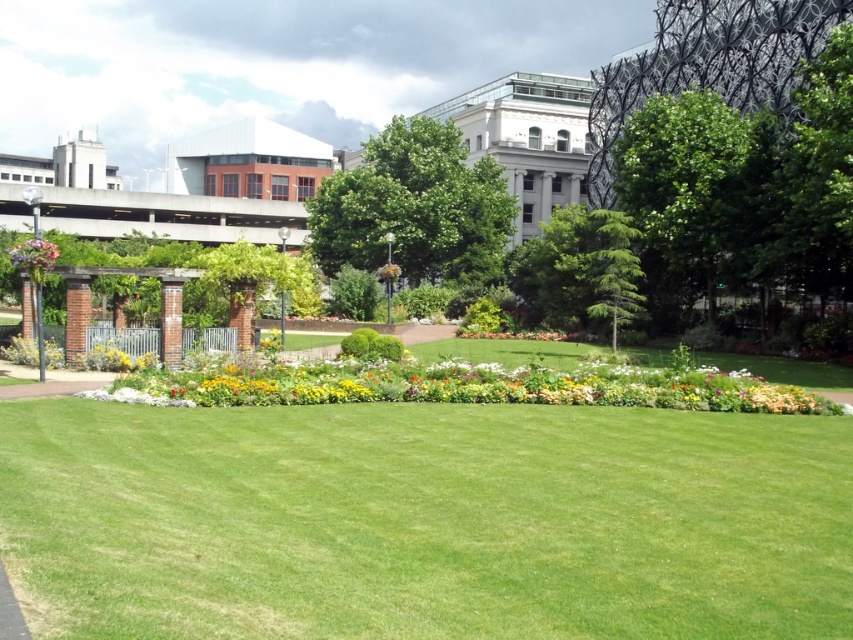
You are standing at the point marked as point (415, 208) in the park. Looking around, you see a green leafy tree at center. Which direction should you walk to reach the flowerbed with colorful flowers in the middle ground?

The point (415, 208) is located on the green leafy tree at center. To reach the flowerbed with colorful flowers in the middle ground, you should walk towards the foreground since the flowerbed is in the middle ground, which is between the foreground grassy area and the background greenery.

You are standing at the entrance of the park and want to reach the green smooth lawn at center. According to the coordinates provided, in which direction should you walk from your current position to reach it?

The green smooth lawn at center is located at coordinates point (424, 522), so you should walk towards the center of the park to reach it.

You are a park visitor who wants to walk from the green smooth lawn at center to the green leafy tree at center. How far will you have to walk?

The green smooth lawn at center is 43.57 meters from the green leafy tree at center, so you will have to walk 43.57 meters to reach the tree.